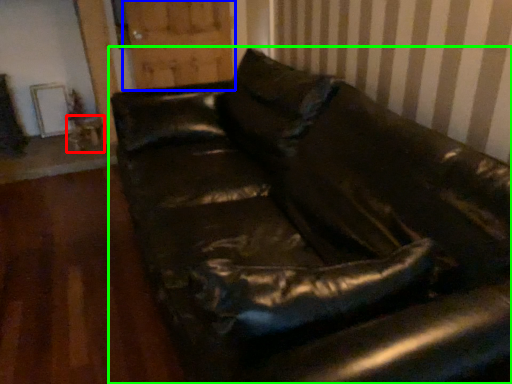
Question: Estimate the real-world distances between objects in this image. Which object is closer to table (highlighted by a red box), barn door (highlighted by a blue box) or studio couch (highlighted by a green box)?

Choices:
 (A) barn door
 (B) studio couch

Answer: (A)